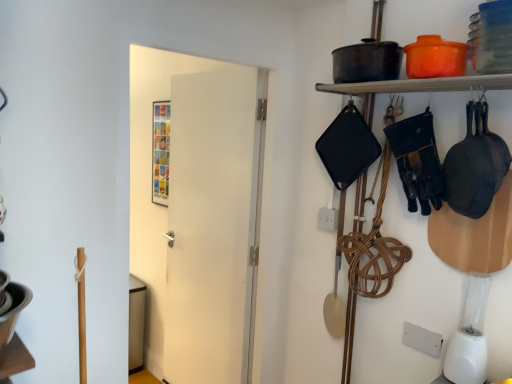
Question: Is matte black pot at upper right positioned before white plastic blender at lower right?

Choices:
 (A) no
 (B) yes

Answer: (B)

Question: Is matte black pot at upper right in contact with white plastic blender at lower right?

Choices:
 (A) no
 (B) yes

Answer: (A)

Question: Is matte black pot at upper right to the left of white plastic blender at lower right from the viewer's perspective?

Choices:
 (A) no
 (B) yes

Answer: (B)

Question: From the image's perspective, is matte black pot at upper right under white plastic blender at lower right?

Choices:
 (A) no
 (B) yes

Answer: (A)

Question: From a real-world perspective, is matte black pot at upper right located beneath white plastic blender at lower right?

Choices:
 (A) no
 (B) yes

Answer: (A)

Question: Is matte black pot at upper right bigger than white plastic blender at lower right?

Choices:
 (A) no
 (B) yes

Answer: (A)

Question: Does white matte door at center have a lesser height compared to white plastic blender at lower right?

Choices:
 (A) yes
 (B) no

Answer: (B)

Question: Does white matte door at center have a lesser width compared to white plastic blender at lower right?

Choices:
 (A) yes
 (B) no

Answer: (A)

Question: Is the depth of white matte door at center greater than that of white plastic blender at lower right?

Choices:
 (A) yes
 (B) no

Answer: (A)

Question: Does white matte door at center appear on the right side of white plastic blender at lower right?

Choices:
 (A) no
 (B) yes

Answer: (A)

Question: From the image's perspective, is white matte door at center below white plastic blender at lower right?

Choices:
 (A) yes
 (B) no

Answer: (B)

Question: Is white matte door at center taller than white plastic blender at lower right?

Choices:
 (A) yes
 (B) no

Answer: (A)

Question: Does matte black pot at upper right have a greater height compared to white matte door at center?

Choices:
 (A) no
 (B) yes

Answer: (A)